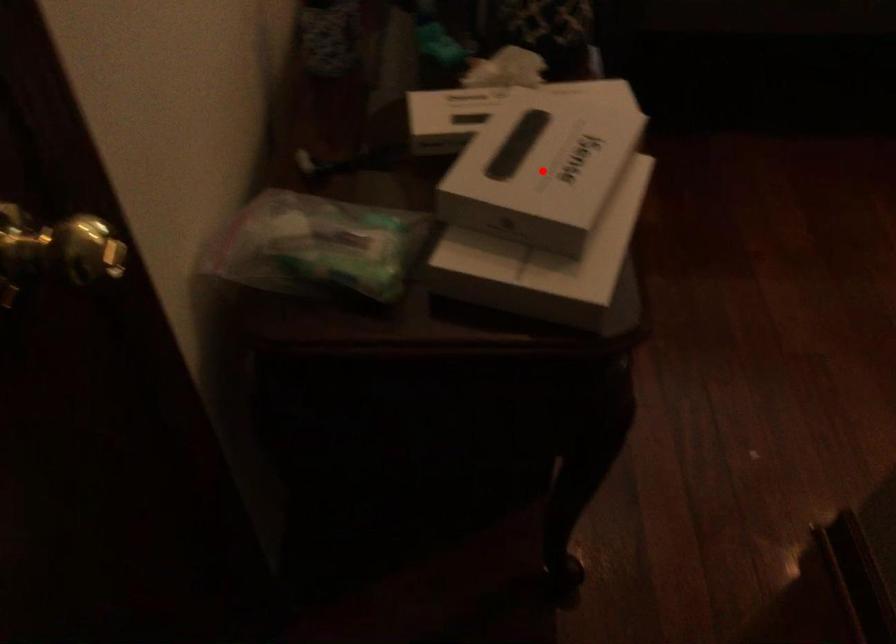
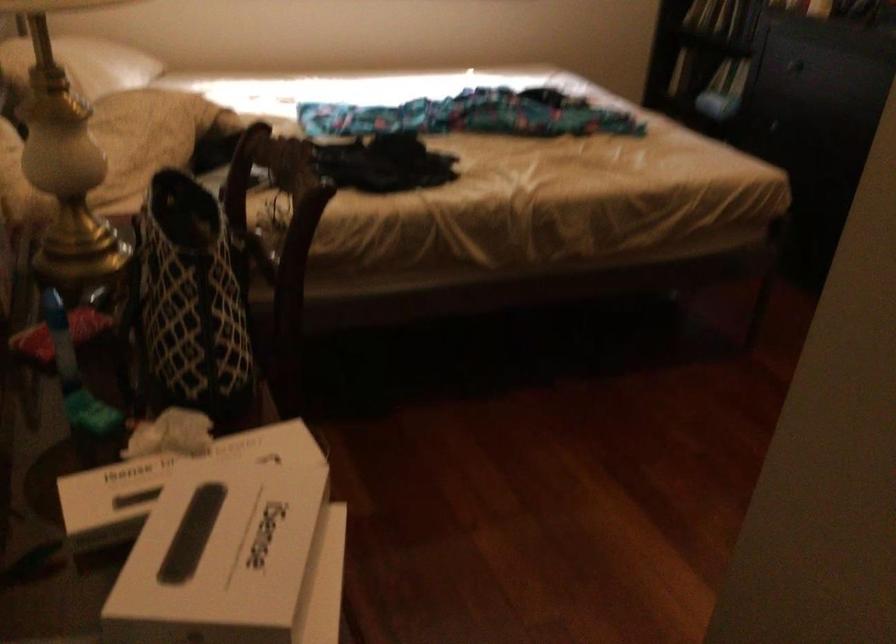
Find the pixel in the second image that matches the highlighted location in the first image.

(234, 560)